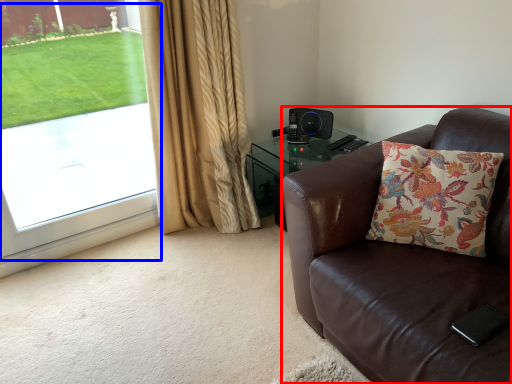
Question: Which point is closer to the camera, chair (highlighted by a red box) or window screen (highlighted by a blue box)?

Choices:
 (A) chair
 (B) window screen

Answer: (A)